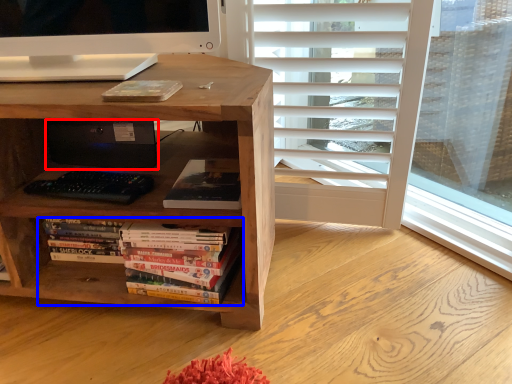
Question: Among these objects, which one is nearest to the camera, computer (highlighted by a red box) or book (highlighted by a blue box)?

Choices:
 (A) computer
 (B) book

Answer: (B)